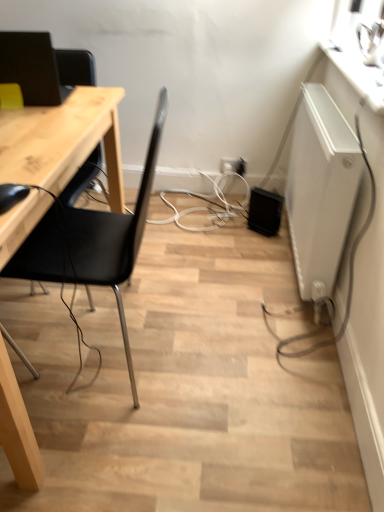
In order to click on vacant area to the left of white matte radiator at right in this screenshot , I will do `click(223, 250)`.